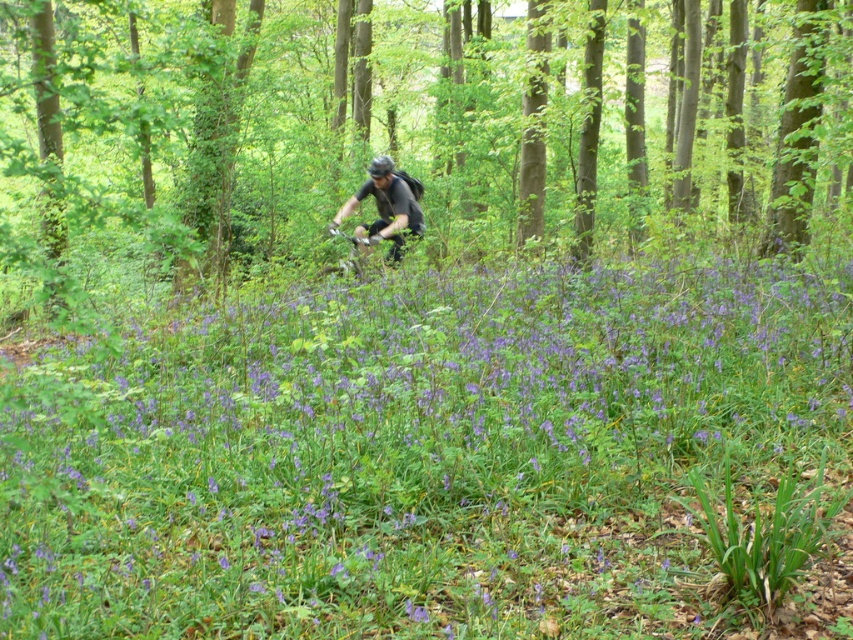
Question: Can you confirm if green leafy tree at center is positioned to the right of shiny black helmet at center?

Choices:
 (A) yes
 (B) no

Answer: (A)

Question: Among these objects, which one is farthest from the camera?

Choices:
 (A) shiny black helmet at center
 (B) purple matte flowers at center

Answer: (A)

Question: Can you confirm if purple matte flowers at center is positioned below green leafy tree at center?

Choices:
 (A) yes
 (B) no

Answer: (A)

Question: Which point appears farthest from the camera in this image?

Choices:
 (A) (114, 193)
 (B) (677, 268)

Answer: (A)

Question: Is purple matte flowers at center closer to camera compared to shiny black helmet at center?

Choices:
 (A) no
 (B) yes

Answer: (B)

Question: Which of the following is the closest to the observer?

Choices:
 (A) (90, 552)
 (B) (373, 168)
 (C) (315, 113)

Answer: (A)